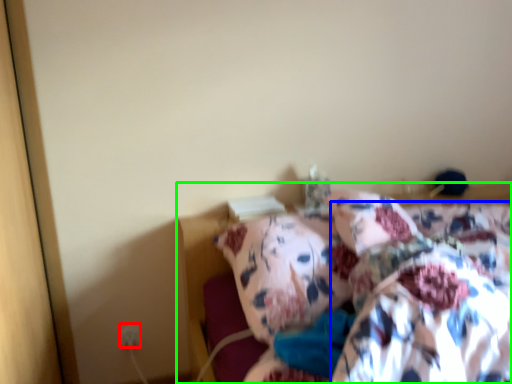
Question: Considering the real-world distances, which object is closest to electric outlet (highlighted by a red box)? blanket (highlighted by a blue box) or bed (highlighted by a green box).

Choices:
 (A) blanket
 (B) bed

Answer: (B)